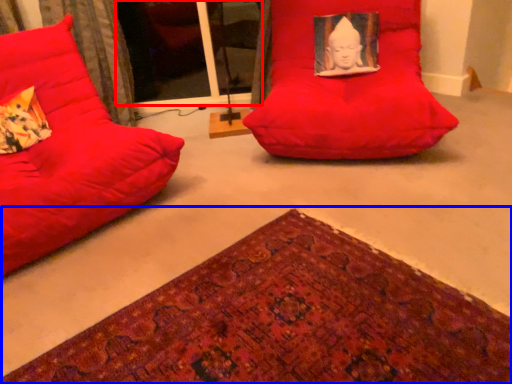
Question: Which object is further to the camera taking this photo, glass door (highlighted by a red box) or mat (highlighted by a blue box)?

Choices:
 (A) glass door
 (B) mat

Answer: (A)